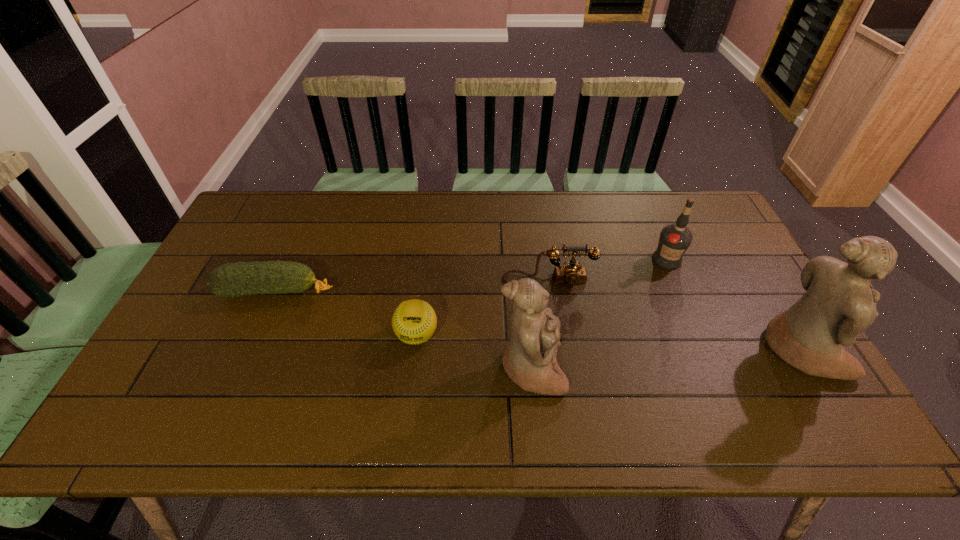
Where is `unoccupied area between the telephone and the fourth shortest object`? The image size is (960, 540). unoccupied area between the telephone and the fourth shortest object is located at coordinates (608, 269).

I want to click on vacant area between the taller figurine and the vodka, so click(x=733, y=305).

You are a GUI agent. You are given a task and a screenshot of the screen. Output one action in this format:
    pyautogui.click(x=<x>, y=<y>)
    Task: Click on the object that ranks as the third closest to the softball
    The height and width of the screenshot is (540, 960).
    Given the screenshot: What is the action you would take?
    pyautogui.click(x=572, y=273)

Select which object is the closest to the shortest object. Please provide its 2D coordinates. Your answer should be formatted as a tuple, i.e. [(x, y)], where the tuple contains the x and y coordinates of a point satisfying the conditions above.

[(414, 321)]

You are a GUI agent. You are given a task and a screenshot of the screen. Output one action in this format:
    pyautogui.click(x=<x>, y=<y>)
    Task: Click on the blank space that satisfies the following two spatial constraints: 1. on the front-facing side of the telephone; 2. at the blossom end of the shortest object
    
    Given the screenshot: What is the action you would take?
    pyautogui.click(x=551, y=292)

What are the coordinates of `vacant space that satisfies the following two spatial constraints: 1. on the front label of the third tallest object; 2. on the front-facing side of the second tallest object` in the screenshot? It's located at (713, 369).